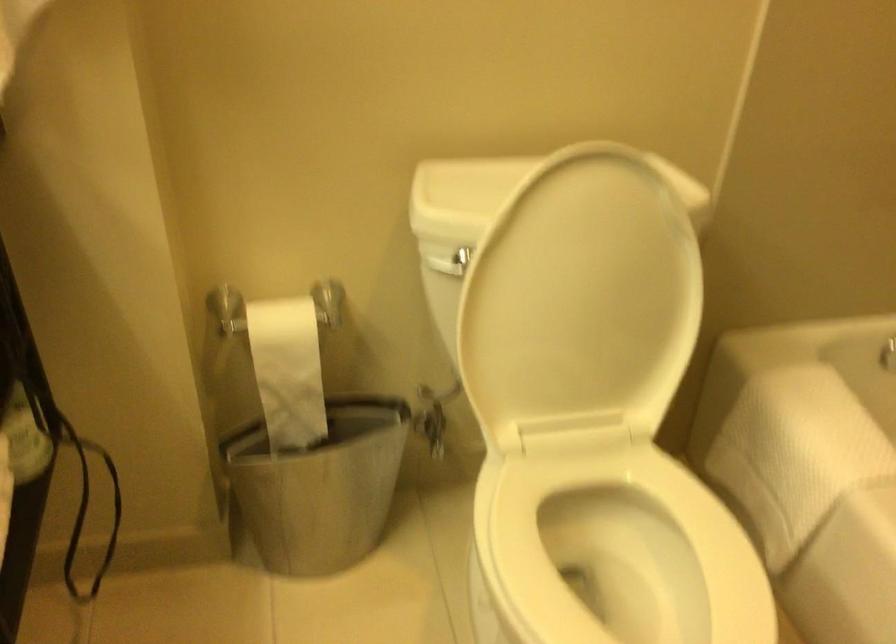
You are a GUI agent. You are given a task and a screenshot of the screen. Output one action in this format:
    pyautogui.click(x=<x>, y=<y>)
    Task: Click on the white toilet seat
    This screenshot has width=896, height=644.
    Given the screenshot: What is the action you would take?
    pyautogui.click(x=607, y=554)